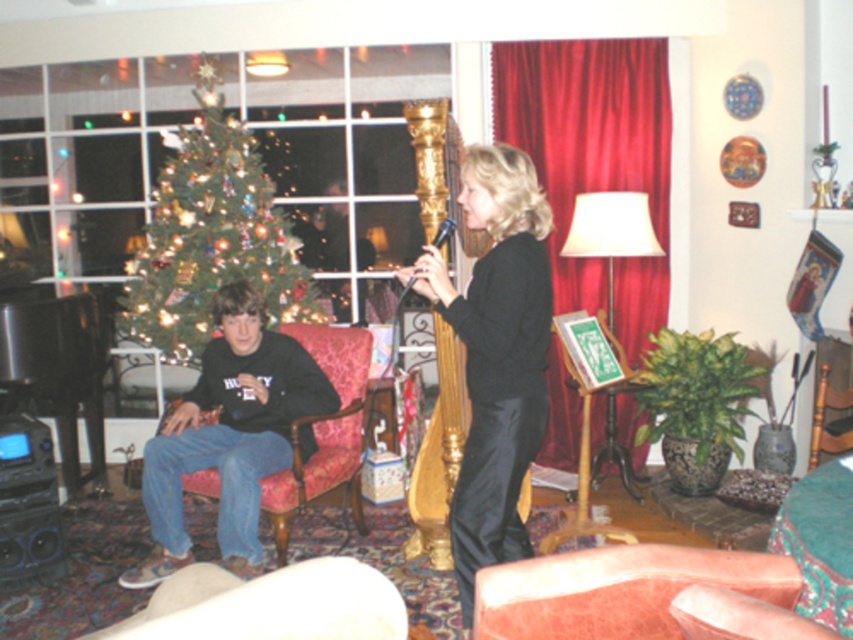
Does velvet pink armchair at lower center appear over wooden armchair at lower right?

No, velvet pink armchair at lower center is not above wooden armchair at lower right.

Who is more distant from viewer, (612, 582) or (849, 397)?

The point (849, 397) is behind.

Is point (523, 611) behind point (821, 448)?

No, (523, 611) is closer to viewer.

The image size is (853, 640). I want to click on velvet pink armchair at lower center, so click(x=618, y=589).

Is matte black hautboy at left to the left of wooden armchair at lower right from the viewer's perspective?

Correct, you'll find matte black hautboy at left to the left of wooden armchair at lower right.

Identify the location of matte black hautboy at left. The width and height of the screenshot is (853, 640). (229, 435).

Does green matte christmas tree at left appear under velvet pink armchair at lower center?

Actually, green matte christmas tree at left is above velvet pink armchair at lower center.

Which is in front, point (193, 224) or point (578, 580)?

Point (578, 580) is more forward.

This screenshot has height=640, width=853. I want to click on green matte christmas tree at left, so click(x=212, y=236).